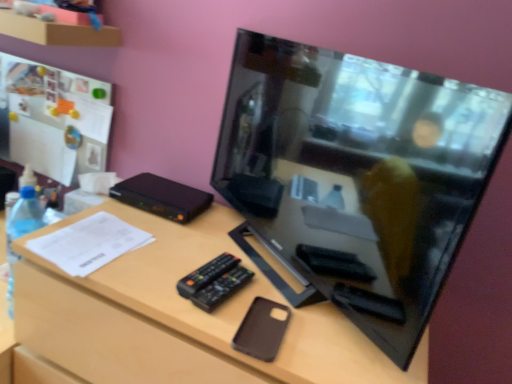
The width and height of the screenshot is (512, 384). Identify the location of brown matte phone case at center. (180, 316).

Identify the location of black glossy television at center. (358, 175).

Find the location of a particular element. This screenshot has height=384, width=512. brown matte phone case at center is located at coordinates (180, 316).

From a real-world perspective, between brown matte phone case at center and brown matte phone case at center, who is vertically higher?

In real-world perspective, brown matte phone case at center is above.

How distant is brown matte phone case at center from brown matte phone case at center?

A distance of 21.12 centimeters exists between brown matte phone case at center and brown matte phone case at center.

Which is correct: brown matte phone case at center is inside brown matte phone case at center, or outside of it?

The correct answer is: inside.

Which of these two, brown matte phone case at center or brown matte phone case at center, stands taller?

brown matte phone case at center is taller.

Is black glossy television at center at the back of black plastic remote at center?

Yes, black plastic remote at center's orientation is away from black glossy television at center.

Would you say black plastic remote at center is inside or outside black glossy television at center?

black plastic remote at center is not inside black glossy television at center, it's outside.

This screenshot has width=512, height=384. Find the location of `remote that appears below the black glossy television at center (from a real-world perspective)`. remote that appears below the black glossy television at center (from a real-world perspective) is located at coordinates (206, 274).

From the image's perspective, is black plastic remote at center above or below black glossy television at center?

black plastic remote at center is situated lower than black glossy television at center in the image.

In order to click on gadget on the right of black plastic remote at center in this screenshot , I will do `click(262, 329)`.

Based on their sizes in the image, would you say black plastic remote at center is bigger or smaller than brown matte phone case at center?

black plastic remote at center is bigger than brown matte phone case at center.

Does black plastic remote at center come in front of brown matte phone case at center?

No, it is behind brown matte phone case at center.

From the image's perspective, is clear plastic bottle at left on brown matte phone case at center?

Yes, from the image's perspective, clear plastic bottle at left is on top of brown matte phone case at center.

From a real-world perspective, is clear plastic bottle at left positioned over brown matte phone case at center based on gravity?

Incorrect, from a real-world perspective, clear plastic bottle at left is lower than brown matte phone case at center.

Is clear plastic bottle at left turned away from brown matte phone case at center?

No, clear plastic bottle at left is not facing away from brown matte phone case at center.

Is black plastic remote at center taller or shorter than clear plastic bottle at left?

black plastic remote at center is shorter than clear plastic bottle at left.

From a real-world perspective, is black plastic remote at center over clear plastic bottle at left?

Yes, from a real-world perspective, black plastic remote at center is above clear plastic bottle at left.

Is clear plastic bottle at left at the back of black plastic remote at center?

No, black plastic remote at center is not facing the opposite direction of clear plastic bottle at left.

Is black plastic remote at center located outside clear plastic bottle at left?

Yes, black plastic remote at center is located beyond the bounds of clear plastic bottle at left.

Is black plastic remote at center wider or thinner than brown matte phone case at center?

In the image, black plastic remote at center appears to be more narrow than brown matte phone case at center.

Can we say black plastic remote at center lies outside brown matte phone case at center?

Yes, black plastic remote at center is located beyond the bounds of brown matte phone case at center.

Is there a large distance between black plastic remote at center and brown matte phone case at center?

No.

From the image's perspective, is black plastic remote at center positioned above or below brown matte phone case at center?

Based on their image positions, black plastic remote at center is located above brown matte phone case at center.

Between brown matte phone case at center and clear plastic bottle at left, which one has larger width?

brown matte phone case at center.

Is brown matte phone case at center looking in the opposite direction of clear plastic bottle at left?

That's not correct — brown matte phone case at center is not looking away from clear plastic bottle at left.

Who is more distant, brown matte phone case at center or clear plastic bottle at left?

clear plastic bottle at left is more distant.

Considering the sizes of brown matte phone case at center and clear plastic bottle at left in the image, is brown matte phone case at center taller or shorter than clear plastic bottle at left?

Considering their sizes, brown matte phone case at center has more height than clear plastic bottle at left.

The width and height of the screenshot is (512, 384). Find the location of `gadget that is above the brown matte phone case at center (from the image's perspective)`. gadget that is above the brown matte phone case at center (from the image's perspective) is located at coordinates (262, 329).

Where is `remote that is on the left side of black glossy television at center`? Image resolution: width=512 pixels, height=384 pixels. remote that is on the left side of black glossy television at center is located at coordinates (206, 274).

Looking at the image, which one is located closer to brown matte phone case at center, black plastic remote at center or brown matte phone case at center?

Among the two, black plastic remote at center is located nearer to brown matte phone case at center.

Which object lies nearer to the anchor point black glossy television at center, black plastic remote at center or black plastic remote at center?

Based on the image, black plastic remote at center appears to be nearer to black glossy television at center.

Based on their spatial positions, is brown matte phone case at center or black glossy television at center further from brown matte phone case at center?

The object further to brown matte phone case at center is black glossy television at center.

Based on the photo, estimate the real-world distances between objects in this image. Which object is further from black plastic remote at center, black plastic remote at center or black glossy television at center?

black glossy television at center is positioned further to the anchor black plastic remote at center.

Based on the photo, from the image, which object appears to be farther from black glossy television at center, black plastic remote at center or brown matte phone case at center?

Among the two, black plastic remote at center is located further to black glossy television at center.

Which object lies further to the anchor point black plastic remote at center, black plastic remote at center or brown matte phone case at center?

brown matte phone case at center lies further to black plastic remote at center than the other object.

Based on the photo, which object lies further to the anchor point black plastic remote at center, clear plastic bottle at left or black plastic remote at center?

clear plastic bottle at left is further to black plastic remote at center.

Considering their positions, is black plastic remote at center positioned closer to black glossy television at center than clear plastic bottle at left?

black plastic remote at center lies closer to black glossy television at center than the other object.

Image resolution: width=512 pixels, height=384 pixels. Identify the location of gadget between clear plastic bottle at left and black glossy television at center from left to right. (262, 329).

Where is `control between black glossy television at center and black plastic remote at center in the front-back direction`? Image resolution: width=512 pixels, height=384 pixels. control between black glossy television at center and black plastic remote at center in the front-back direction is located at coordinates (221, 288).

At what (x,y) coordinates should I click in order to perform the action: click on control between black glossy television at center and brown matte phone case at center in the vertical direction. Please return your answer as a coordinate pair (x, y). Looking at the image, I should click on (221, 288).

Locate an element on the screen. The image size is (512, 384). gadget between black plastic remote at center and brown matte phone case at center vertically is located at coordinates (262, 329).